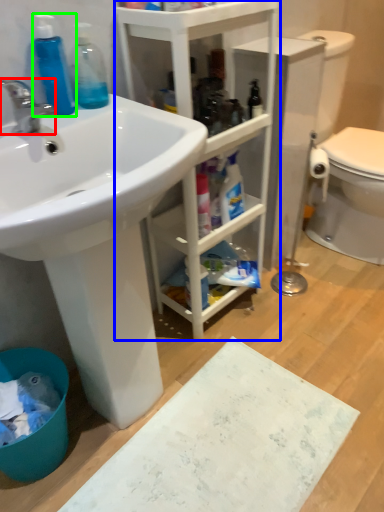
Question: Which object is positioned farthest from tap (highlighted by a red box)? Select from bathroom cabinet (highlighted by a blue box) and cleaning product (highlighted by a green box).

Choices:
 (A) bathroom cabinet
 (B) cleaning product

Answer: (A)